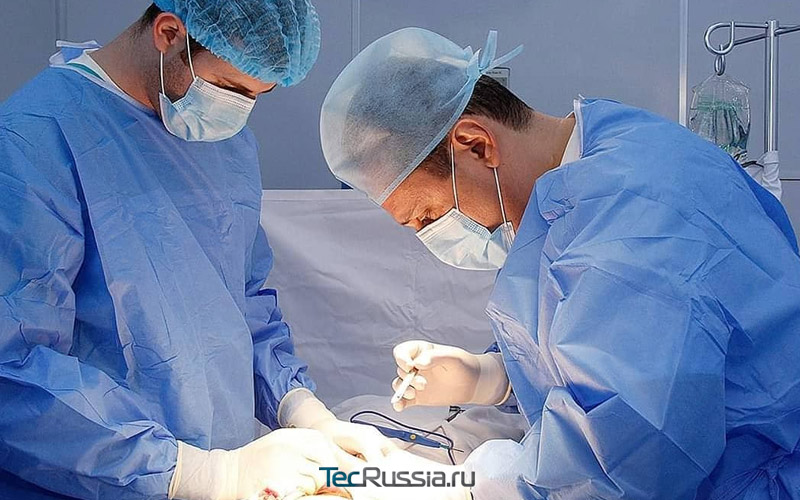
This screenshot has height=500, width=800. Find the location of `sheet`. sheet is located at coordinates (330, 271).